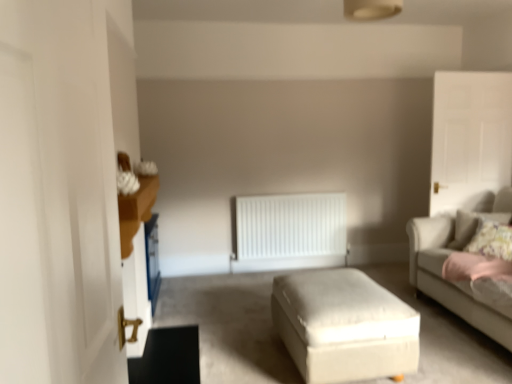
What do you see at coordinates (458, 251) in the screenshot? The height and width of the screenshot is (384, 512). I see `beige fabric couch at right` at bounding box center [458, 251].

At what (x,y) coordinates should I click in order to perform the action: click on white glossy door at upper right, acting as the 2th glass door starting from the left. Please return your answer as a coordinate pair (x, y). Image resolution: width=512 pixels, height=384 pixels. Looking at the image, I should click on (470, 138).

Image resolution: width=512 pixels, height=384 pixels. I want to click on beige fabric couch at right, so click(x=458, y=251).

Based on their positions, is white glossy door at left, which is the first glass door from left to right, located to the left or right of white matte radiator at center?

In the image, white glossy door at left, which is the first glass door from left to right, appears on the left side of white matte radiator at center.

Where is `radiator beneath the white glossy door at left, arranged as the second glass door when viewed from the back (from a real-world perspective)`? This screenshot has width=512, height=384. radiator beneath the white glossy door at left, arranged as the second glass door when viewed from the back (from a real-world perspective) is located at coordinates (290, 226).

From the picture: Can you tell me how much white glossy door at left, arranged as the second glass door when viewed from the back, and white matte radiator at center differ in facing direction?

86.7 degrees separate the facing orientations of white glossy door at left, arranged as the second glass door when viewed from the back, and white matte radiator at center.

Is white fabric ottoman at center a part of white glossy door at upper right, the first glass door from the back?

No, white fabric ottoman at center is located outside of white glossy door at upper right, the first glass door from the back.

In the scene shown: Is white glossy door at upper right, acting as the 2th glass door starting from the left, taller or shorter than white fabric ottoman at center?

Clearly, white glossy door at upper right, acting as the 2th glass door starting from the left, is taller compared to white fabric ottoman at center.

Is white glossy door at upper right, acting as the 2th glass door starting from the front, in front of white fabric ottoman at center?

No, white glossy door at upper right, acting as the 2th glass door starting from the front, is further to the viewer.

Which of these two, white glossy door at upper right, marked as the 1th glass door in a right-to-left arrangement, or white fabric ottoman at center, is smaller?

With smaller size is white glossy door at upper right, marked as the 1th glass door in a right-to-left arrangement.

Which point is more distant from viewer, (45, 363) or (466, 229)?

The point (466, 229) is farther.

From the image's perspective, which one is positioned higher, white glossy door at left, arranged as the second glass door when viewed from the back, or beige fabric couch at right?

white glossy door at left, arranged as the second glass door when viewed from the back, appears higher in the image.

Are white glossy door at left, positioned as the first glass door in front-to-back order, and beige fabric couch at right beside each other?

No, white glossy door at left, positioned as the first glass door in front-to-back order, is not beside beige fabric couch at right.

Is white matte radiator at center in front of or behind fluffy floral pillow at right in the image?

white matte radiator at center is behind fluffy floral pillow at right.

Which is in front, point (288, 224) or point (506, 214)?

The point (506, 214) is in front.

Is white matte radiator at center looking in the opposite direction of fluffy floral pillow at right?

white matte radiator at center is not turned away from fluffy floral pillow at right.

Between white matte radiator at center and fluffy floral pillow at right, which one has smaller width?

Thinner between the two is white matte radiator at center.

Where is `radiator lying on the left of beige fabric couch at right`? radiator lying on the left of beige fabric couch at right is located at coordinates (290, 226).

Is white matte radiator at center to the left of beige fabric couch at right from the viewer's perspective?

Yes, white matte radiator at center is to the left of beige fabric couch at right.

Is white matte radiator at center oriented towards beige fabric couch at right?

Yes, white matte radiator at center is turned towards beige fabric couch at right.

From the image's perspective, between white matte radiator at center and beige fabric couch at right, which one is located above?

white matte radiator at center.

The width and height of the screenshot is (512, 384). Identify the location of glass door in front of the white fabric ottoman at center. (57, 196).

From the image's perspective, which object appears higher, white glossy door at left, arranged as the second glass door when viewed from the back, or white fabric ottoman at center?

From the image's view, white glossy door at left, arranged as the second glass door when viewed from the back, is above.

Is white glossy door at left, arranged as the second glass door when viewed from the back, in contact with white fabric ottoman at center?

No, white glossy door at left, arranged as the second glass door when viewed from the back, is not next to white fabric ottoman at center.

Does point (37, 213) appear closer or farther from the camera than point (316, 305)?

Clearly, point (37, 213) is closer to the camera than point (316, 305).

Is white glossy door at left, arranged as the second glass door when viewed from the back, in front of or behind fluffy floral pillow at right in the image?

Visually, white glossy door at left, arranged as the second glass door when viewed from the back, is located in front of fluffy floral pillow at right.

From the image's perspective, starting from the fluffy floral pillow at right, which glass door is the 1st one above? Please provide its 2D coordinates.

[(57, 196)]

Which is correct: white glossy door at left, positioned as the first glass door in front-to-back order, is inside fluffy floral pillow at right, or outside of it?

white glossy door at left, positioned as the first glass door in front-to-back order, is not inside fluffy floral pillow at right, it's outside.

Considering the sizes of objects white glossy door at left, positioned as the first glass door in front-to-back order, and fluffy floral pillow at right in the image provided, who is bigger, white glossy door at left, positioned as the first glass door in front-to-back order, or fluffy floral pillow at right?

With larger size is white glossy door at left, positioned as the first glass door in front-to-back order.

Where is `radiator lying on the right of white glossy door at left, positioned as the first glass door in front-to-back order`? radiator lying on the right of white glossy door at left, positioned as the first glass door in front-to-back order is located at coordinates tap(290, 226).

You are a GUI agent. You are given a task and a screenshot of the screen. Output one action in this format:
    pyautogui.click(x=<x>, y=<y>)
    Task: Click on the glass door that is the 2nd one when counting upward from the white fabric ottoman at center (from the image's perspective)
    Image resolution: width=512 pixels, height=384 pixels.
    Given the screenshot: What is the action you would take?
    pyautogui.click(x=470, y=138)

Looking at the image, which one is located further to fluffy floral pillow at right, white glossy door at upper right, acting as the 2th glass door starting from the front, or white glossy door at left, positioned as the first glass door in front-to-back order?

white glossy door at left, positioned as the first glass door in front-to-back order, is positioned further to the anchor fluffy floral pillow at right.

Considering their positions, is white fabric ottoman at center positioned further to white matte radiator at center than fluffy floral pillow at right?

Among the two, white fabric ottoman at center is located further to white matte radiator at center.

Based on their spatial positions, is white glossy door at upper right, acting as the 2th glass door starting from the left, or white glossy door at left, arranged as the second glass door when viewed from the back, closer to beige fabric couch at right?

white glossy door at upper right, acting as the 2th glass door starting from the left, is closer to beige fabric couch at right.

Based on the photo, from the image, which object appears to be nearer to white glossy door at left, positioned as the first glass door in front-to-back order, fluffy floral pillow at right or white glossy door at upper right, marked as the 1th glass door in a right-to-left arrangement?

Based on the image, fluffy floral pillow at right appears to be nearer to white glossy door at left, positioned as the first glass door in front-to-back order.

When comparing their distances from white matte radiator at center, does white glossy door at upper right, marked as the 1th glass door in a right-to-left arrangement, or fluffy floral pillow at right seem further?

fluffy floral pillow at right.

Estimate the real-world distances between objects in this image. Which object is further from white fabric ottoman at center, beige fabric couch at right or fluffy floral pillow at right?

Among the two, fluffy floral pillow at right is located further to white fabric ottoman at center.

Looking at the image, which one is located closer to white matte radiator at center, white fabric ottoman at center or white glossy door at left, positioned as the first glass door in front-to-back order?

The object closer to white matte radiator at center is white fabric ottoman at center.

Looking at the image, which one is located further to white glossy door at left, which is the first glass door from left to right, beige fabric couch at right or fluffy floral pillow at right?

fluffy floral pillow at right is positioned further to the anchor white glossy door at left, which is the first glass door from left to right.

Locate an element on the screen. Image resolution: width=512 pixels, height=384 pixels. glass door between white glossy door at left, which is the first glass door from left to right, and white matte radiator at center, along the z-axis is located at coordinates (470, 138).

Identify the location of studio couch located between white glossy door at left, which is the first glass door from left to right, and fluffy floral pillow at right in the depth direction. The width and height of the screenshot is (512, 384). click(x=458, y=251).

The height and width of the screenshot is (384, 512). I want to click on pillow between beige fabric couch at right and white matte radiator at center along the z-axis, so click(472, 225).

Where is `studio couch positioned between white fabric ottoman at center and white matte radiator at center from near to far`? Image resolution: width=512 pixels, height=384 pixels. studio couch positioned between white fabric ottoman at center and white matte radiator at center from near to far is located at coordinates (458, 251).